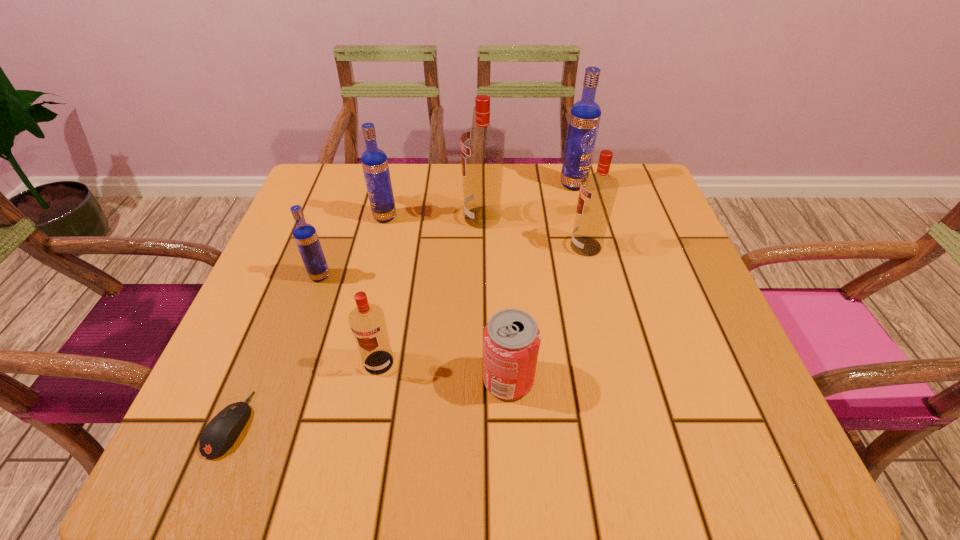
This screenshot has width=960, height=540. I want to click on the biggest blue vodka, so click(x=584, y=119).

I want to click on the farthest object, so click(584, 119).

Where is `the fourth vodka from left to right`? the fourth vodka from left to right is located at coordinates (482, 146).

Locate an element on the screen. The height and width of the screenshot is (540, 960). the biggest red vodka is located at coordinates (482, 146).

What are the coordinates of `the second blue vodka from left to right` in the screenshot? It's located at (374, 161).

Locate an element on the screen. The image size is (960, 540). the second smallest blue vodka is located at coordinates (374, 161).

The height and width of the screenshot is (540, 960). What are the coordinates of `the second smallest red vodka` in the screenshot? It's located at (598, 190).

Find the location of a particular element. Image resolution: width=960 pixels, height=540 pixels. the second nearest red vodka is located at coordinates (598, 190).

Where is `the leftmost vodka`? the leftmost vodka is located at coordinates (305, 235).

The image size is (960, 540). Identify the location of the smallest blue vodka. (305, 235).